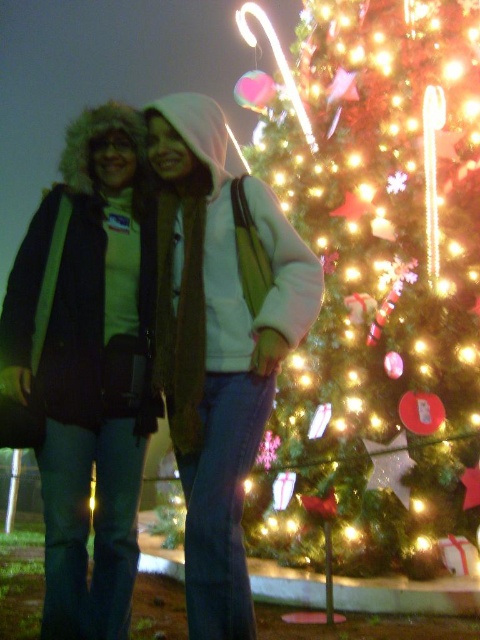
You are a photographer trying to capture a group photo of the two people in the scene. The illuminated green at center and the matte black jacket at center are the subjects. Which subject should you focus on to ensure proper exposure given the lighting conditions?

You should focus on the illuminated green at center because it is brighter and will help balance the exposure for both subjects.

From the picture: You are trying to decide which jacket to wear for a cold evening. Both jackets are available in the same size. However, you notice that the matte black jacket at center is wider than the brushed metal jacket at left. If you want a jacket that is narrower, which one should you choose?

You should choose the brushed metal jacket at left because it is narrower than the matte black jacket at center.